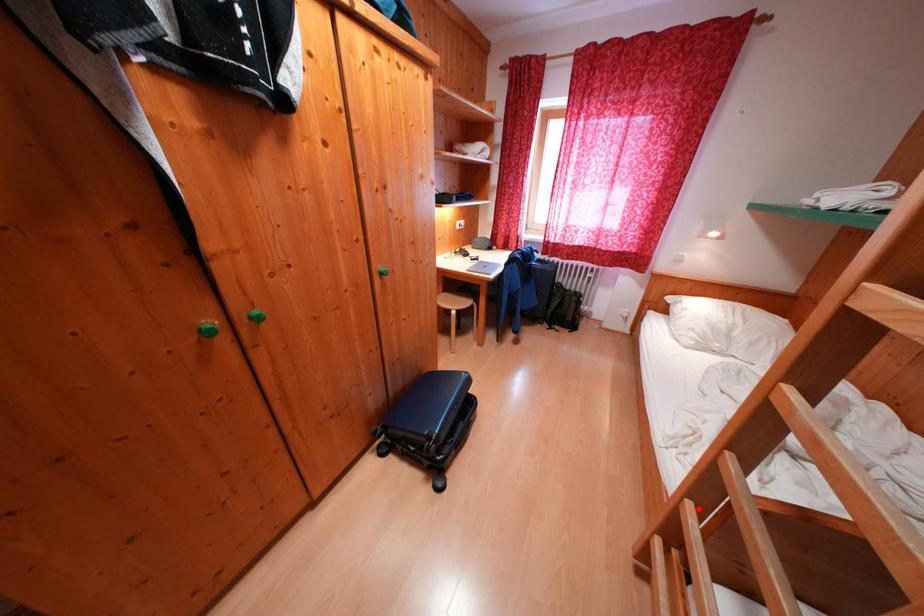
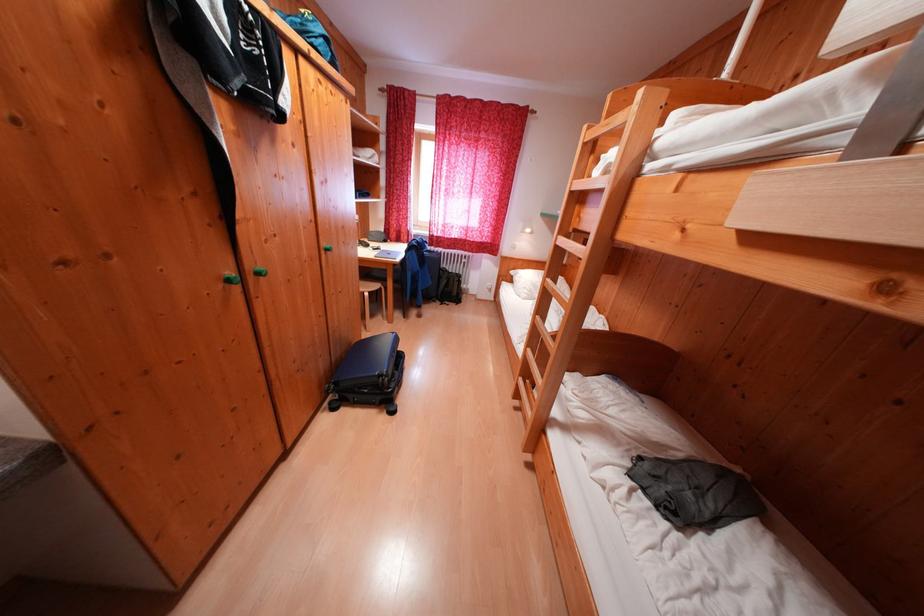
In the second image, find the point that corresponds to the highlighted location in the first image.

(537, 354)